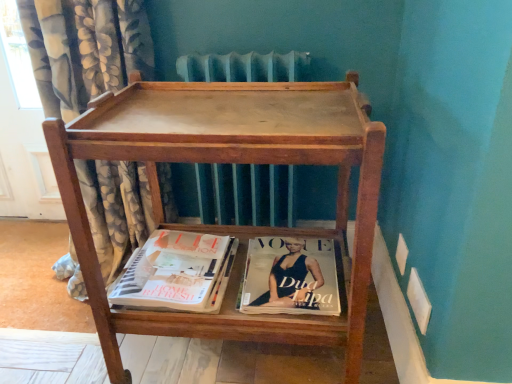
Question: From a real-world perspective, is matte paper magazine at lower center located higher than floral fabric curtain at left?

Choices:
 (A) no
 (B) yes

Answer: (A)

Question: Does matte paper magazine at lower center appear on the left side of floral fabric curtain at left?

Choices:
 (A) yes
 (B) no

Answer: (B)

Question: Is matte paper magazine at lower center outside floral fabric curtain at left?

Choices:
 (A) no
 (B) yes

Answer: (B)

Question: Is matte paper magazine at lower center thinner than floral fabric curtain at left?

Choices:
 (A) yes
 (B) no

Answer: (A)

Question: Is matte paper magazine at lower center closer to the viewer compared to floral fabric curtain at left?

Choices:
 (A) yes
 (B) no

Answer: (B)

Question: Based on their positions, is matte paper magazine at lower center located to the left or right of wooden tray at center?

Choices:
 (A) left
 (B) right

Answer: (A)

Question: From a real-world perspective, is matte paper magazine at lower center physically located above or below wooden tray at center?

Choices:
 (A) below
 (B) above

Answer: (A)

Question: Choose the correct answer: Is matte paper magazine at lower center inside wooden tray at center or outside it?

Choices:
 (A) outside
 (B) inside

Answer: (B)

Question: Is point (166, 246) closer or farther from the camera than point (371, 175)?

Choices:
 (A) closer
 (B) farther

Answer: (B)

Question: Looking at their shapes, would you say matte paper magazine at lower center is wider or thinner than floral fabric curtain at left?

Choices:
 (A) wide
 (B) thin

Answer: (B)

Question: Is matte paper magazine at lower center in front of or behind floral fabric curtain at left in the image?

Choices:
 (A) front
 (B) behind

Answer: (B)

Question: Would you say matte paper magazine at lower center is to the left or to the right of floral fabric curtain at left in the picture?

Choices:
 (A) right
 (B) left

Answer: (A)

Question: Looking at the image, does matte paper magazine at lower center seem bigger or smaller compared to floral fabric curtain at left?

Choices:
 (A) big
 (B) small

Answer: (B)

Question: Does point (110, 24) appear closer or farther from the camera than point (220, 264)?

Choices:
 (A) closer
 (B) farther

Answer: (B)

Question: In the image, is floral fabric curtain at left on the left side or the right side of matte paper magazine at lower center?

Choices:
 (A) right
 (B) left

Answer: (B)